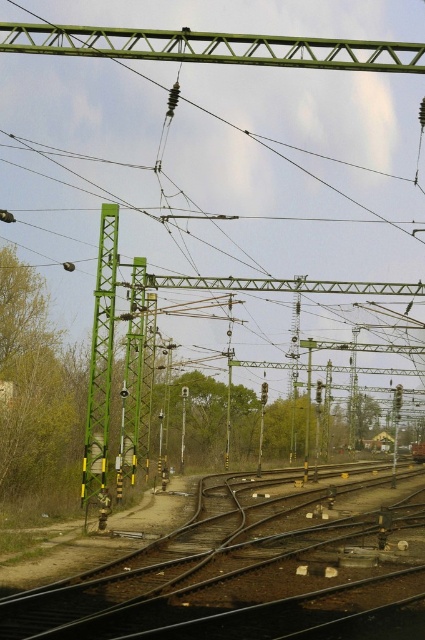
Which is above, dark brown metal train track at center or green matte pole at center?

Positioned higher is green matte pole at center.

Which is in front, point (238, 602) or point (104, 273)?

Point (238, 602) is more forward.

Locate an element on the screen. Image resolution: width=425 pixels, height=640 pixels. dark brown metal train track at center is located at coordinates (249, 564).